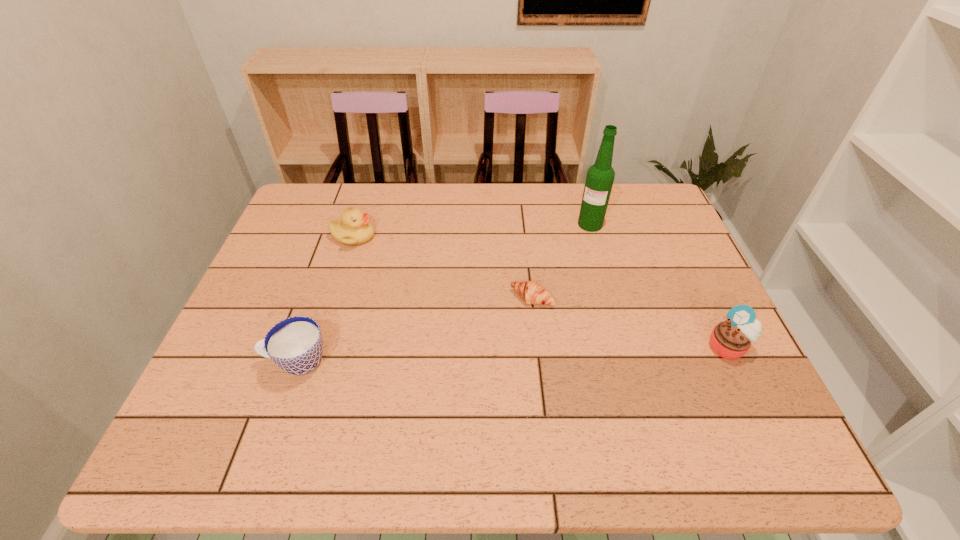
Locate an element on the screen. The image size is (960, 540). free space on the desktop that is between the cup and the rightmost object and is positioned on the label of the tallest object is located at coordinates (549, 354).

Locate an element on the screen. This screenshot has width=960, height=540. vacant spot on the desktop that is between the cup and the rightmost object and is positioned on the front-facing side of the third object from left to right is located at coordinates (492, 355).

Locate an element on the screen. The height and width of the screenshot is (540, 960). free spot on the desktop that is between the cup and the muffin and is positioned on the beak of the duckling is located at coordinates (569, 353).